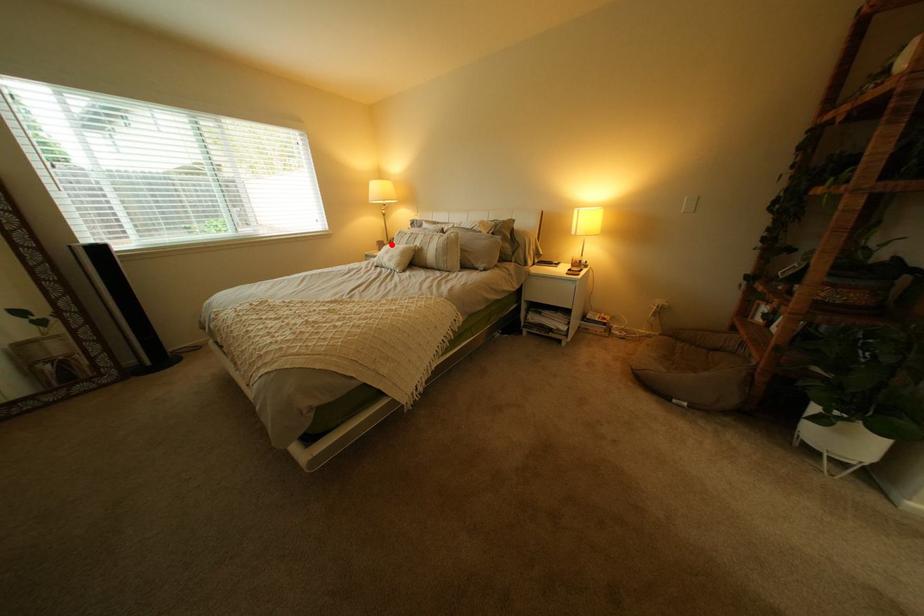
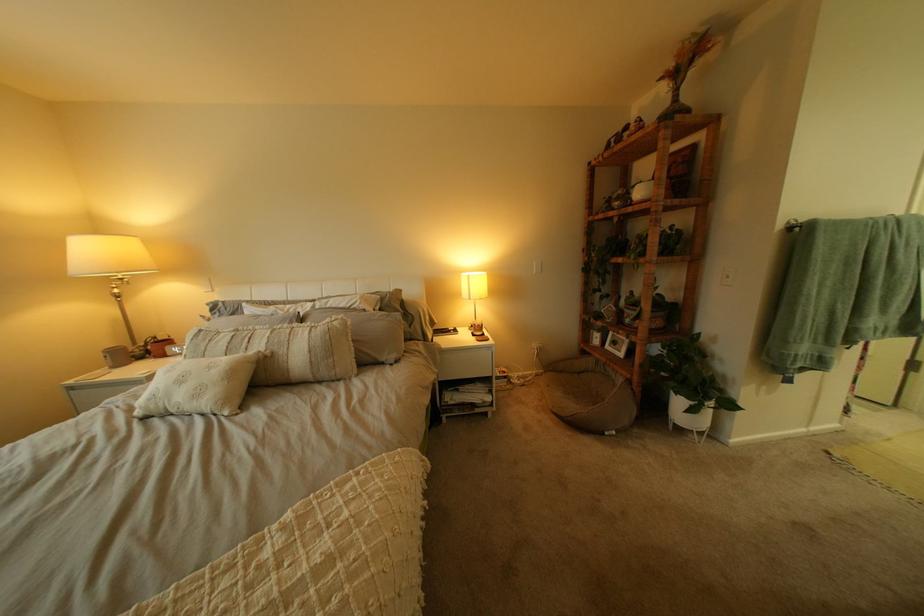
Question: I am providing you with two images of the same scene from different viewpoints. Image1 has a red point marked. In image2, the corresponding 3D location appears at what relative position? Reply with the corresponding letter.

Choices:
 (A) Closer
 (B) Farther

Answer: (A)